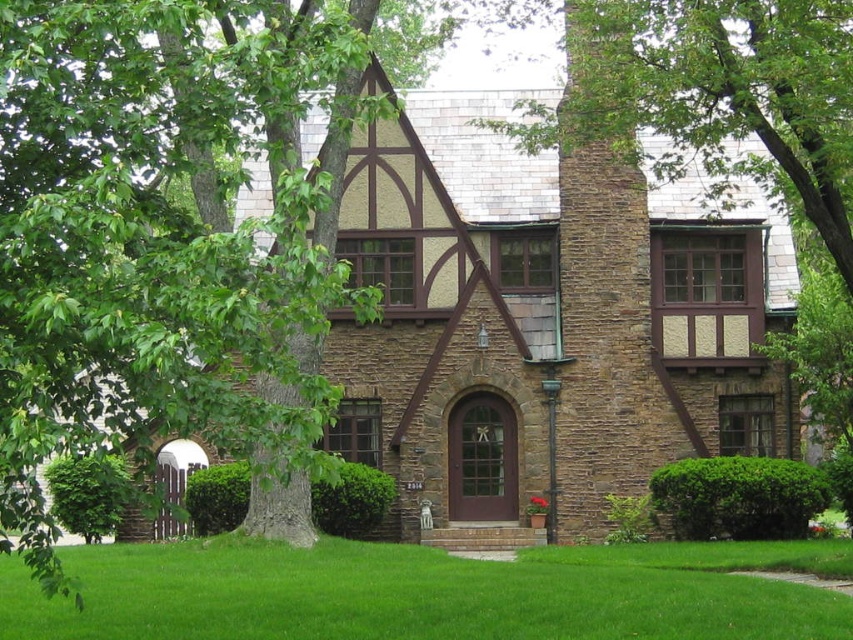
You are standing in front of the Tudor Revival house and want to place a new garden ornament. The ornament needs to be placed on the green grass at lower center. However, you want to ensure it won not block the view of the brown stone chimney at upper right. Can you confirm if placing it there would be possible?

The green grass at lower center is located below the brown stone chimney at upper right, so placing the ornament on the green grass at lower center would not block the view of the brown stone chimney at upper right as it is positioned lower down.

You are standing in front of the Tudor Revival house and notice a specific point marked at coordinates (430, 593). According to the image, what is located at that point?

The point at coordinates (430, 593) indicates green grass at lower center.

Consider the image. You are standing at the front door of the house and want to walk towards the green grass at lower center. Which direction should you walk in?

The green grass at lower center is located at point (430,593) in the image. Since you are at the front door, which is centrally located, you should walk forward towards the lower center direction to reach the green grass at lower center.